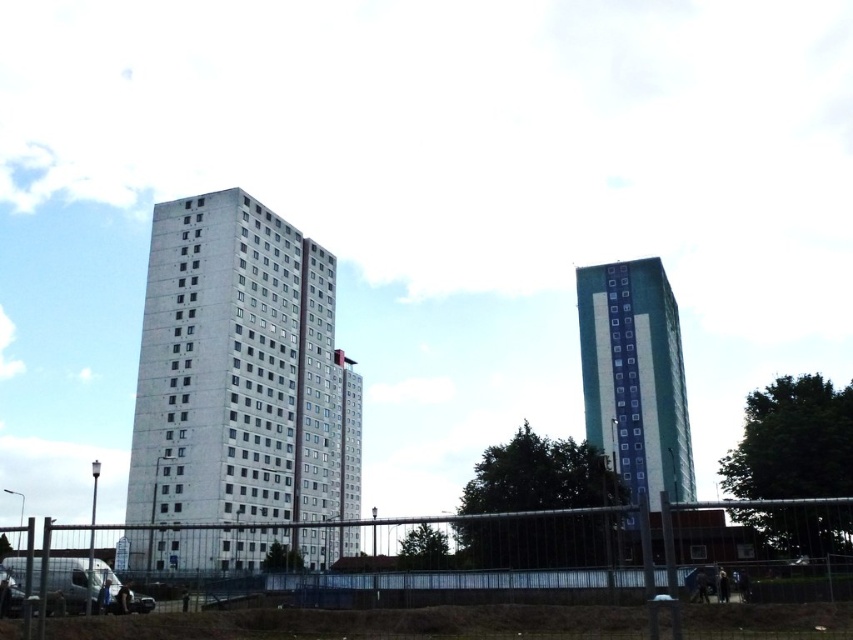
Question: Based on their relative distances, which object is nearer to the teal glass tower at right?

Choices:
 (A) metal fence at lower center
 (B) concrete building at center

Answer: (B)

Question: Is concrete building at center above metal fence at lower center?

Choices:
 (A) yes
 (B) no

Answer: (A)

Question: Can you confirm if concrete building at center is positioned below teal glass tower at right?

Choices:
 (A) no
 (B) yes

Answer: (A)

Question: Which point is farther to the camera?

Choices:
 (A) teal glass tower at right
 (B) concrete building at center

Answer: (A)

Question: Which object appears closest to the camera in this image?

Choices:
 (A) teal glass tower at right
 (B) metal fence at lower center

Answer: (B)

Question: Can you confirm if metal fence at lower center is positioned above teal glass tower at right?

Choices:
 (A) no
 (B) yes

Answer: (A)